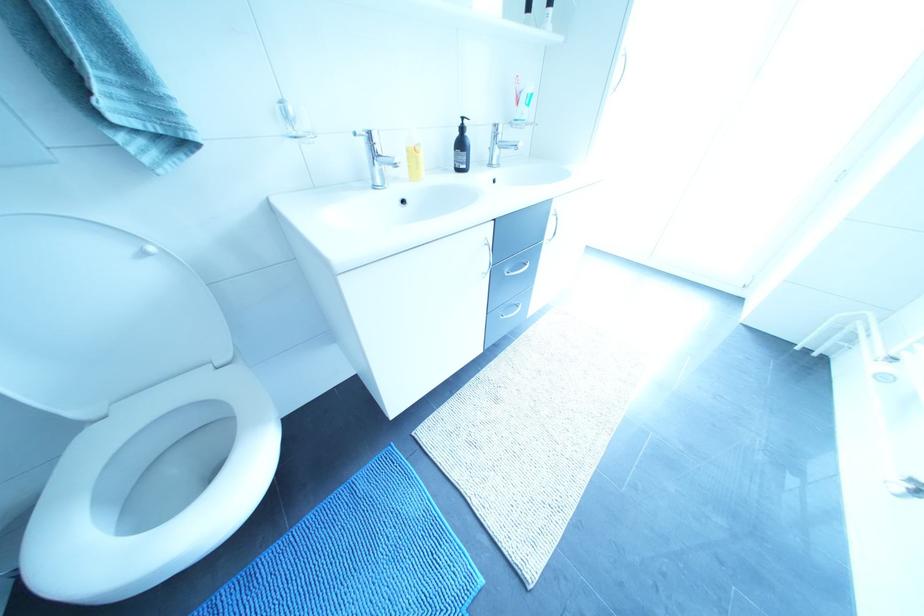
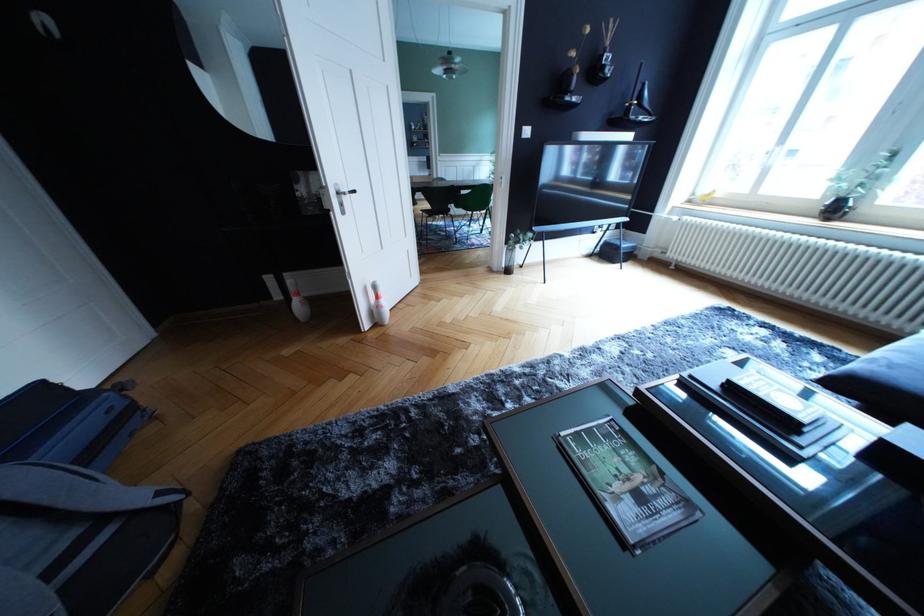
Question: I am providing you with two images of the same scene from different viewpoints. Which of the following objects are not visible in image2?

Choices:
 (A) black wall vase
 (B) green chair sitting surface
 (C) white phone buttons
 (D) white toilet lid

Answer: (D)